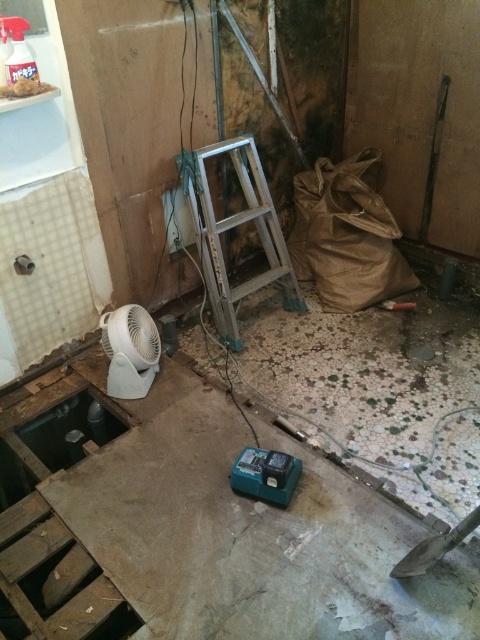
Between point (289, 480) and point (402, 560), which one is positioned behind?

The point (289, 480) is behind.

Is point (255, 449) behind point (418, 566)?

Yes, it is behind point (418, 566).

Where is `green plastic power tool at center`? The image size is (480, 640). green plastic power tool at center is located at coordinates point(265,474).

Does silver metallic ladder at center have a smaller size compared to green plastic power tool at center?

Incorrect, silver metallic ladder at center is not smaller in size than green plastic power tool at center.

Measure the distance between silver metallic ladder at center and green plastic power tool at center.

silver metallic ladder at center is 38.35 inches away from green plastic power tool at center.

Who is more forward, (222, 284) or (290, 458)?

Positioned in front is point (290, 458).

Locate an element on the screen. Image resolution: width=480 pixels, height=640 pixels. silver metallic ladder at center is located at coordinates (233, 227).

Can you confirm if green plastic tool at center is bigger than green plastic power tool at center?

Correct, green plastic tool at center is larger in size than green plastic power tool at center.

Is point (62, 392) positioned before point (255, 480)?

No, (62, 392) is behind (255, 480).

Identify the location of green plastic tool at center. (207, 525).